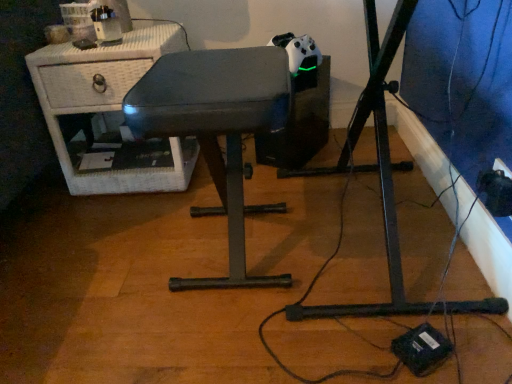
Question: Does white wicker nightstand at upper left, which is counted as the 1th furniture, starting from the left, have a greater width compared to metallic gray stool at center, the second furniture when ordered from back to front?

Choices:
 (A) no
 (B) yes

Answer: (B)

Question: Is white wicker nightstand at upper left, the second furniture when ordered from front to back, turned away from metallic gray stool at center, the second furniture in the left-to-right sequence?

Choices:
 (A) no
 (B) yes

Answer: (A)

Question: Is the depth of white wicker nightstand at upper left, which is counted as the 1th furniture, starting from the left, greater than that of metallic gray stool at center, which is counted as the first furniture, starting from the front?

Choices:
 (A) no
 (B) yes

Answer: (B)

Question: Considering the relative sizes of white wicker nightstand at upper left, the first furniture viewed from the back, and metallic gray stool at center, which is counted as the first furniture, starting from the front, in the image provided, is white wicker nightstand at upper left, the first furniture viewed from the back, bigger than metallic gray stool at center, which is counted as the first furniture, starting from the front,?

Choices:
 (A) yes
 (B) no

Answer: (A)

Question: Does white wicker nightstand at upper left, the first furniture viewed from the back, appear on the right side of metallic gray stool at center, the second furniture in the left-to-right sequence?

Choices:
 (A) yes
 (B) no

Answer: (B)

Question: Are white wicker nightstand at upper left, the first furniture viewed from the back, and metallic gray stool at center, which is counted as the first furniture, starting from the front, far apart?

Choices:
 (A) no
 (B) yes

Answer: (A)

Question: Is metallic gray stool at center, the second furniture when ordered from back to front, shorter than white wicker nightstand at upper left, the first furniture viewed from the back?

Choices:
 (A) no
 (B) yes

Answer: (A)

Question: From a real-world perspective, is metallic gray stool at center, the second furniture when ordered from back to front, on top of white wicker nightstand at upper left, which is counted as the 1th furniture, starting from the left?

Choices:
 (A) yes
 (B) no

Answer: (A)

Question: Is white wicker nightstand at upper left, the second furniture when ordered from front to back, located within metallic gray stool at center, which appears as the first furniture when viewed from the right?

Choices:
 (A) yes
 (B) no

Answer: (B)

Question: From a real-world perspective, is metallic gray stool at center, the second furniture in the left-to-right sequence, under white wicker nightstand at upper left, which is counted as the 1th furniture, starting from the left?

Choices:
 (A) yes
 (B) no

Answer: (B)

Question: Is metallic gray stool at center, which appears as the first furniture when viewed from the right, not within white wicker nightstand at upper left, the first furniture viewed from the back?

Choices:
 (A) yes
 (B) no

Answer: (A)

Question: Is metallic gray stool at center, which appears as the first furniture when viewed from the right, smaller than white wicker nightstand at upper left, the first furniture viewed from the back?

Choices:
 (A) no
 (B) yes

Answer: (B)

Question: In terms of height, does metallic gray stool at center, which is counted as the first furniture, starting from the front, look taller or shorter compared to white wicker nightstand at upper left, which is counted as the 1th furniture, starting from the left?

Choices:
 (A) tall
 (B) short

Answer: (A)